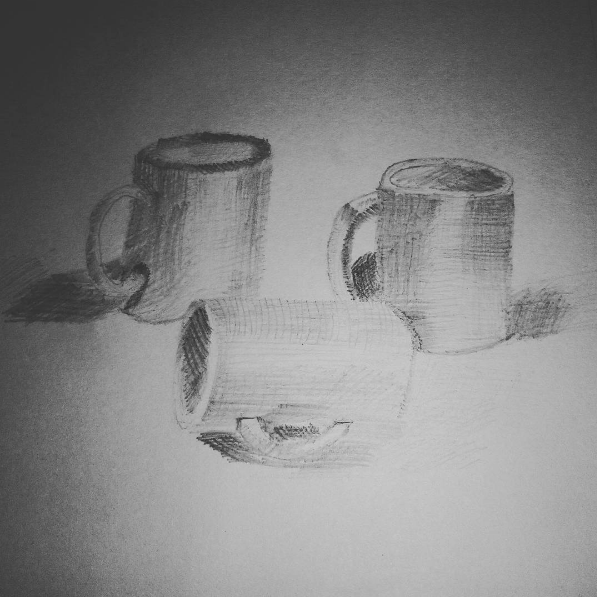
The width and height of the screenshot is (597, 597). Find the location of `empty space above cups`. empty space above cups is located at coordinates (307, 67).